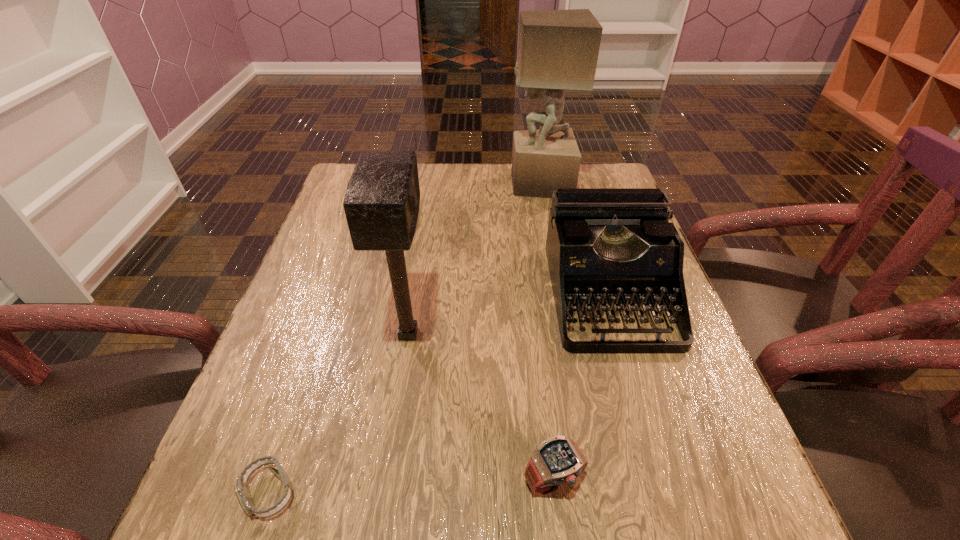
Find the location of a particular element. The image size is (960, 540). vacant space located 0.180m on the front-facing side of the tallest object is located at coordinates (449, 184).

Find the location of a particular element. free space located on the front-facing side of the tallest object is located at coordinates (479, 184).

Find the location of a particular element. The image size is (960, 540). vacant space situated on the front of the second object from left to right is located at coordinates (395, 424).

Where is `vacant region located 0.300m on the typing side of the typewriter`? Image resolution: width=960 pixels, height=540 pixels. vacant region located 0.300m on the typing side of the typewriter is located at coordinates (677, 522).

The height and width of the screenshot is (540, 960). I want to click on vacant space located 0.320m on the left of the right watch, so click(314, 480).

Where is `object that is at the far edge`? Image resolution: width=960 pixels, height=540 pixels. object that is at the far edge is located at coordinates (558, 50).

Identify the location of object that is at the left edge. The height and width of the screenshot is (540, 960). point(241,489).

Where is `sculpture that is at the right edge`? Image resolution: width=960 pixels, height=540 pixels. sculpture that is at the right edge is located at coordinates (558, 50).

Where is `typewriter that is at the right edge`? The height and width of the screenshot is (540, 960). typewriter that is at the right edge is located at coordinates (605, 246).

You are a GUI agent. You are given a task and a screenshot of the screen. Output one action in this format:
    pyautogui.click(x=<x>, y=<y>)
    Task: Click on the object located in the near left corner section of the desktop
    This screenshot has width=960, height=540.
    Given the screenshot: What is the action you would take?
    pyautogui.click(x=241, y=489)